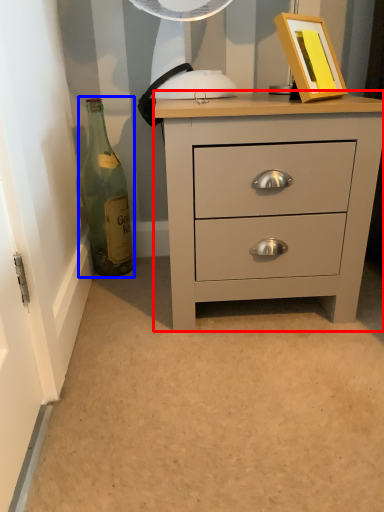
Question: Which object appears closest to the camera in this image, chest of drawers (highlighted by a red box) or bottle (highlighted by a blue box)?

Choices:
 (A) chest of drawers
 (B) bottle

Answer: (A)